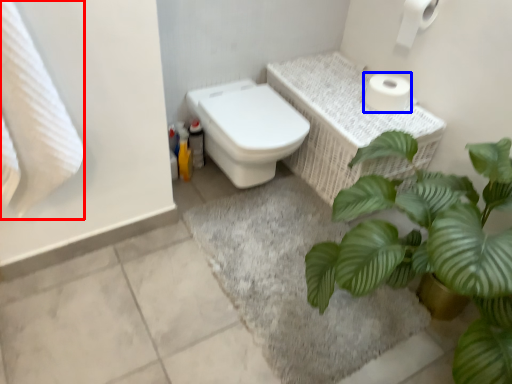
Question: Among these objects, which one is nearest to the camera, bath towel (highlighted by a red box) or toilet paper (highlighted by a blue box)?

Choices:
 (A) bath towel
 (B) toilet paper

Answer: (A)